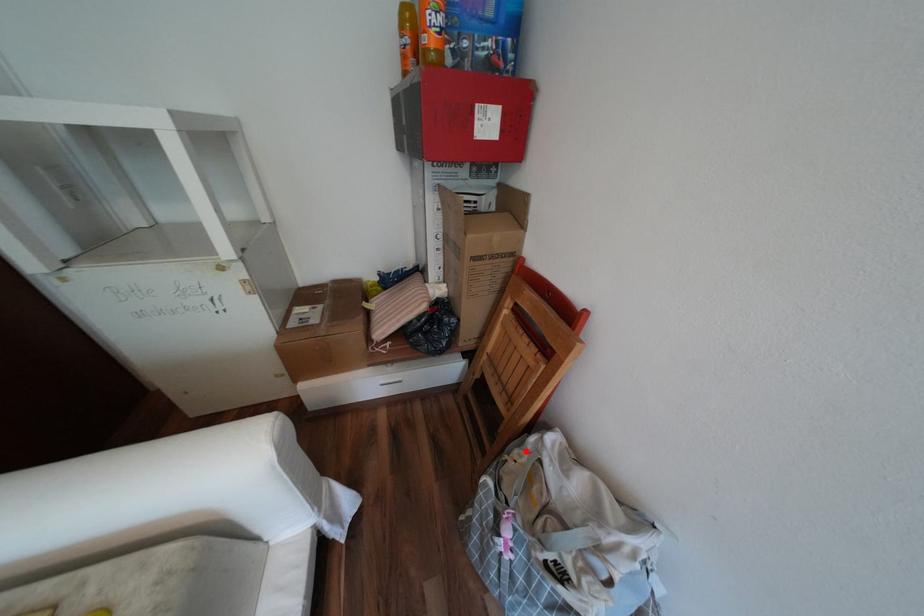
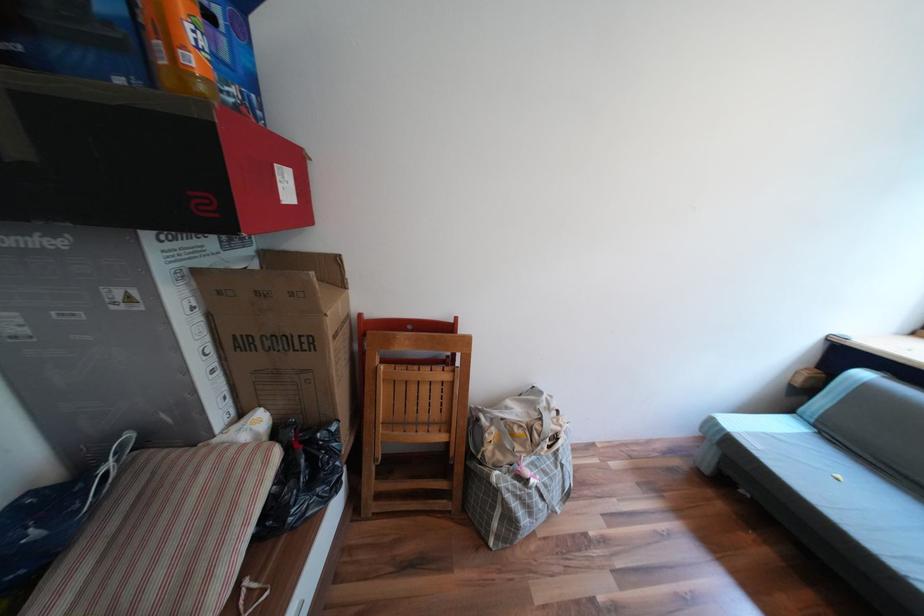
Question: I am providing you with two images of the same scene from different viewpoints. In image1, a red point is highlighted. Considering the same 3D point in image2, which of the following is correct?

Choices:
 (A) It is closer
 (B) It is farther

Answer: (B)